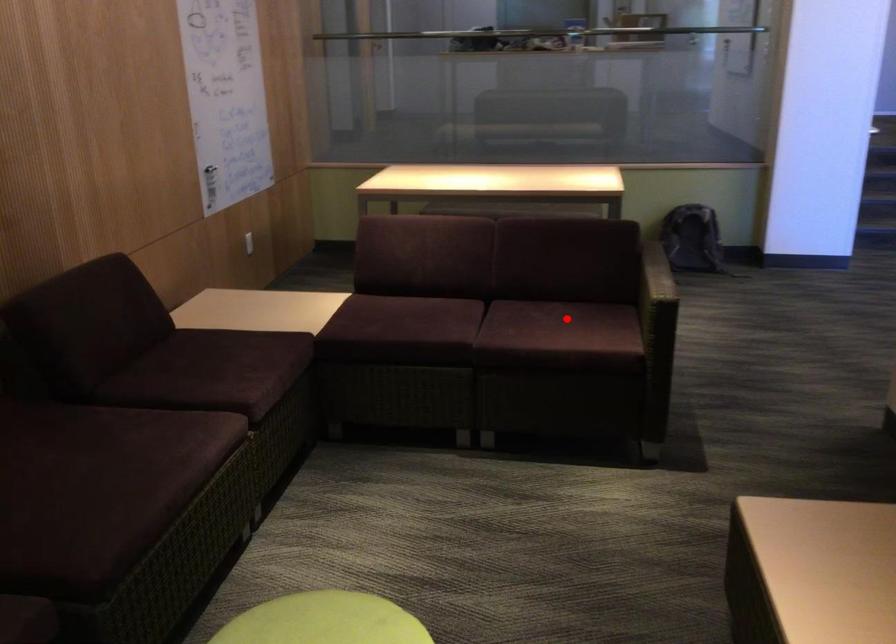
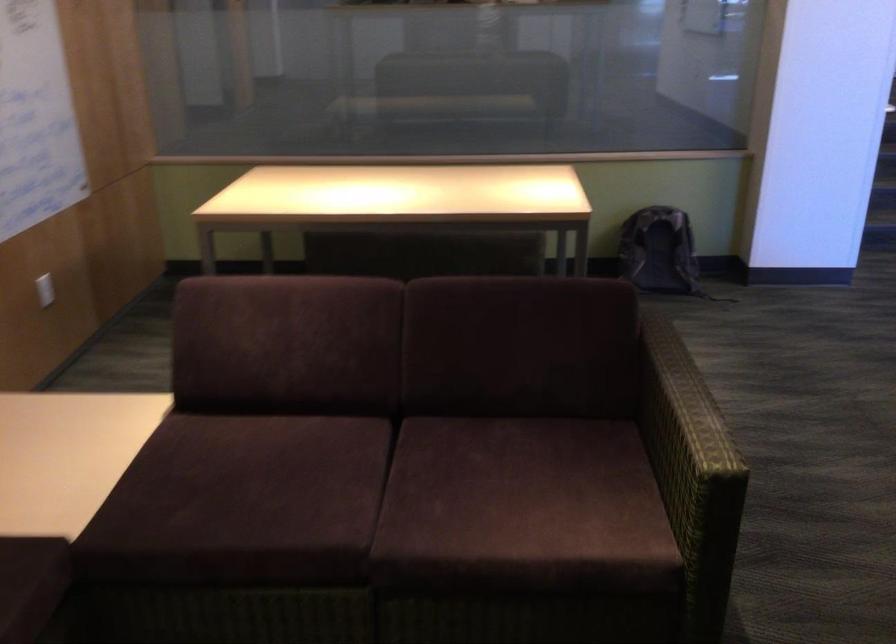
Question: I am providing you with two images of the same scene from different viewpoints. A red point is shown in image1. For the corresponding object point in image2, is it positioned nearer or farther from the camera?

Choices:
 (A) Nearer
 (B) Farther

Answer: (A)